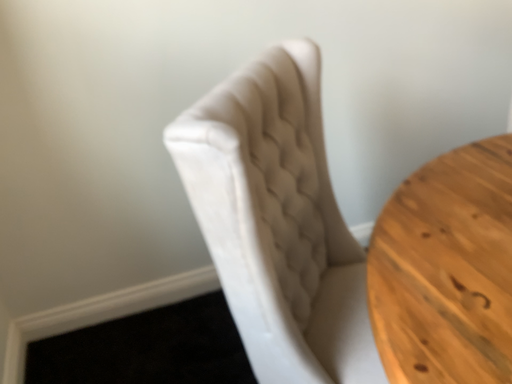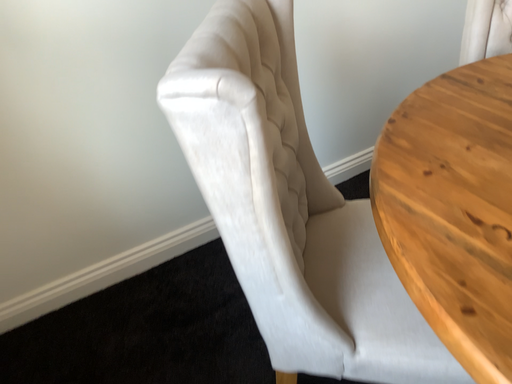
Question: Which way did the camera rotate in the video?

Choices:
 (A) rotated right
 (B) rotated left

Answer: (A)